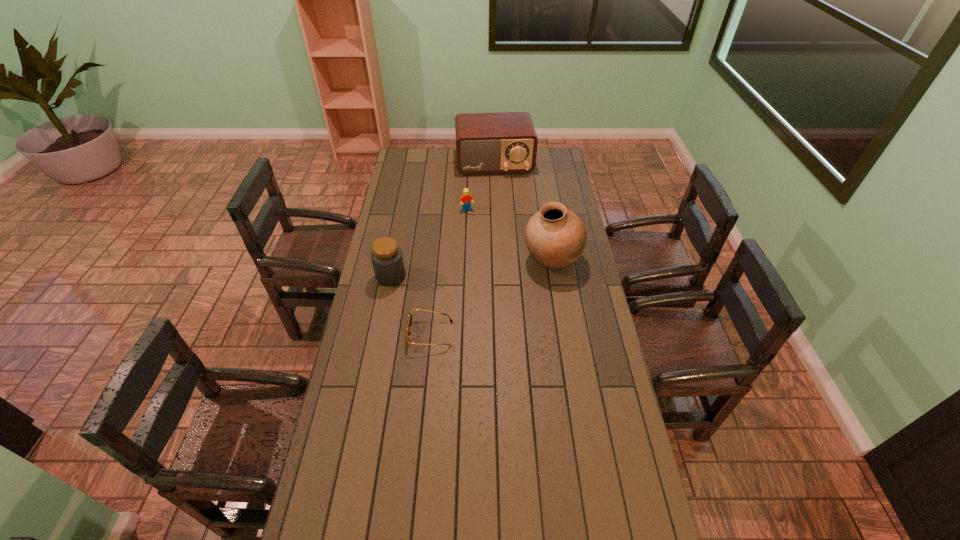
Where is `the nearest object`? the nearest object is located at coordinates (408, 332).

I want to click on sunglasses, so click(x=408, y=332).

Locate an element on the screen. The width and height of the screenshot is (960, 540). pottery is located at coordinates (555, 236).

Where is `the third shortest object`? the third shortest object is located at coordinates (386, 256).

Where is `jar`? The image size is (960, 540). jar is located at coordinates (386, 256).

Where is `Lego`? The height and width of the screenshot is (540, 960). Lego is located at coordinates (466, 198).

Image resolution: width=960 pixels, height=540 pixels. Identify the location of the second farthest object. (466, 198).

Image resolution: width=960 pixels, height=540 pixels. In order to click on radio receiver in this screenshot , I will do `click(505, 142)`.

The width and height of the screenshot is (960, 540). Find the location of `the second tallest object`. the second tallest object is located at coordinates (505, 142).

Locate an element on the screen. The height and width of the screenshot is (540, 960). vacant region located 0.170m on the lenses of the sunglasses is located at coordinates (361, 334).